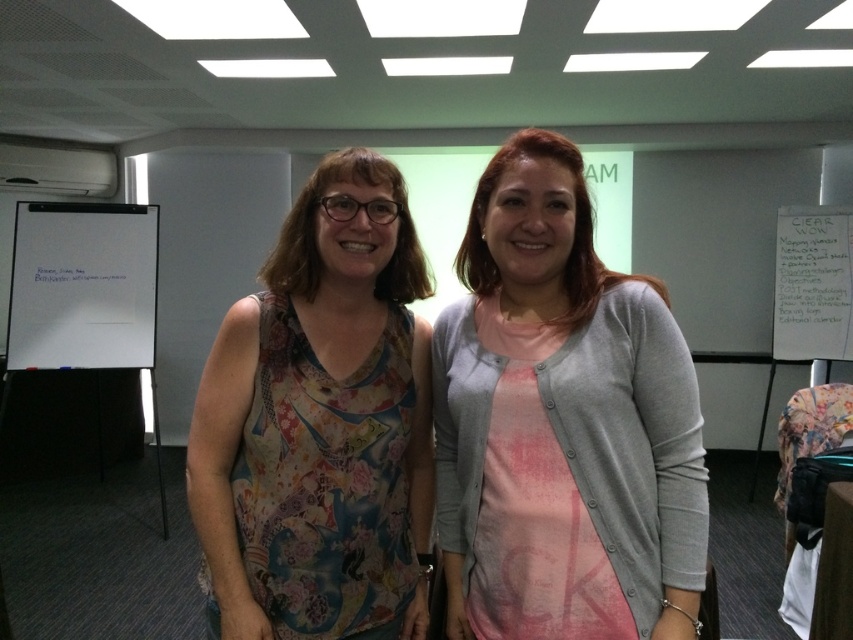
What do you see at coordinates (320, 424) in the screenshot?
I see `floral-patterned tank top at center` at bounding box center [320, 424].

Which is more to the left, floral-patterned tank top at center or whiteboard at left?

whiteboard at left

The image size is (853, 640). Identify the location of floral-patterned tank top at center. (320, 424).

This screenshot has width=853, height=640. I want to click on floral-patterned tank top at center, so coord(320,424).

Is pink fabric shirt at center shorter than floral-patterned tank top at center?

Indeed, pink fabric shirt at center has a lesser height compared to floral-patterned tank top at center.

Who is higher up, pink fabric shirt at center or floral-patterned tank top at center?

pink fabric shirt at center is higher up.

Which is in front, point (572, 148) or point (254, 516)?

Positioned in front is point (572, 148).

This screenshot has height=640, width=853. In order to click on pink fabric shirt at center in this screenshot , I will do `click(561, 424)`.

Is floral-patterned tank top at center bigger than white paper at right?

Yes, floral-patterned tank top at center is bigger than white paper at right.

Between floral-patterned tank top at center and white paper at right, which one is positioned lower?

floral-patterned tank top at center is below.

Where is `floral-patterned tank top at center`? Image resolution: width=853 pixels, height=640 pixels. floral-patterned tank top at center is located at coordinates (320, 424).